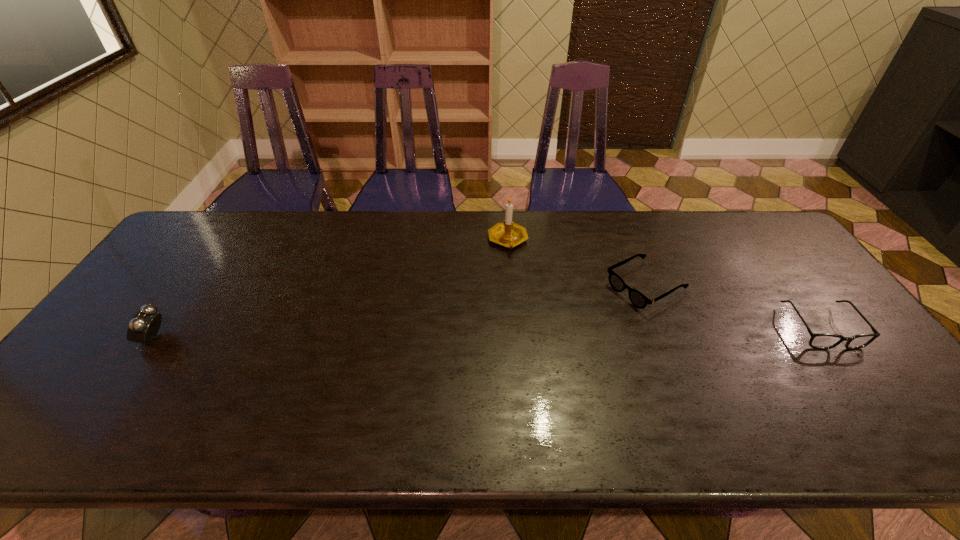
I want to click on free space between the third object from left to right and the candle holder, so (x=576, y=264).

At what (x,y) coordinates should I click in order to perform the action: click on vacant area that lies between the tallest object and the alarm clock. Please return your answer as a coordinate pair (x, y). The width and height of the screenshot is (960, 540). Looking at the image, I should click on (330, 289).

This screenshot has width=960, height=540. Identify the location of empty space between the candle holder and the left spectacles. (576, 264).

The width and height of the screenshot is (960, 540). In order to click on object that is the closest one to the leftmost object in this screenshot , I will do `click(509, 234)`.

Identify the location of object identified as the closest to the tallest object. The width and height of the screenshot is (960, 540). (639, 300).

Identify the location of free space that satisfies the following two spatial constraints: 1. on the front side of the left spectacles; 2. on the right side of the candle holder. (512, 287).